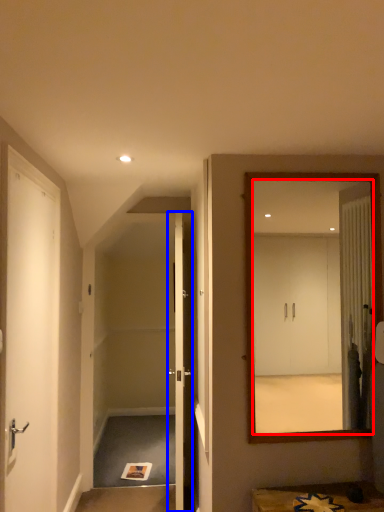
Question: Which point is closer to the camera, mirror (highlighted by a red box) or door (highlighted by a blue box)?

Choices:
 (A) mirror
 (B) door

Answer: (A)